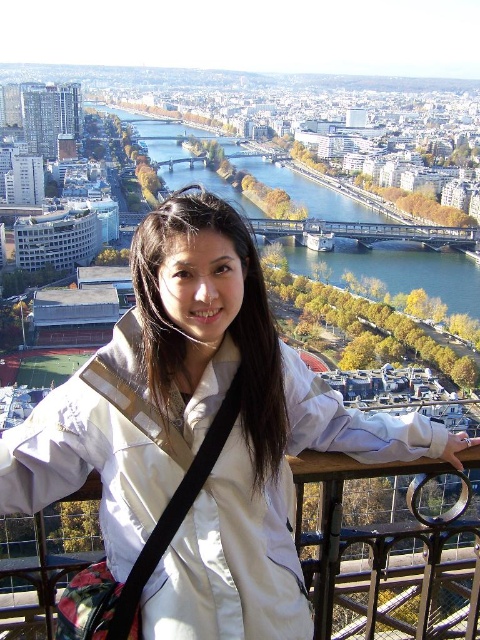
You are a photographer trying to capture the cityscape from the balcony. You notice a point at coordinates (199, 436) in your viewfinder. What object is located at that point?

The point at coordinates (199, 436) corresponds to the white fabric jacket at center.

You are on a balcony overlooking a city. You see two points marked in the scene. The first point is at coordinates point (188, 316) and the second is at point (352, 248). Which point is closer to you?

Point (188, 316) is in front of point (352, 248), so it is closer to you.

You are a photographer planning to capture the cityscape from the balcony. You notice the white fabric jacket at center and the green water at center in your frame. Based on their sizes in the image, which object should you focus on if you want to highlight a smaller subject?

The white fabric jacket at center has a smaller size compared to the green water at center, so you should focus on the white fabric jacket at center to highlight a smaller subject.